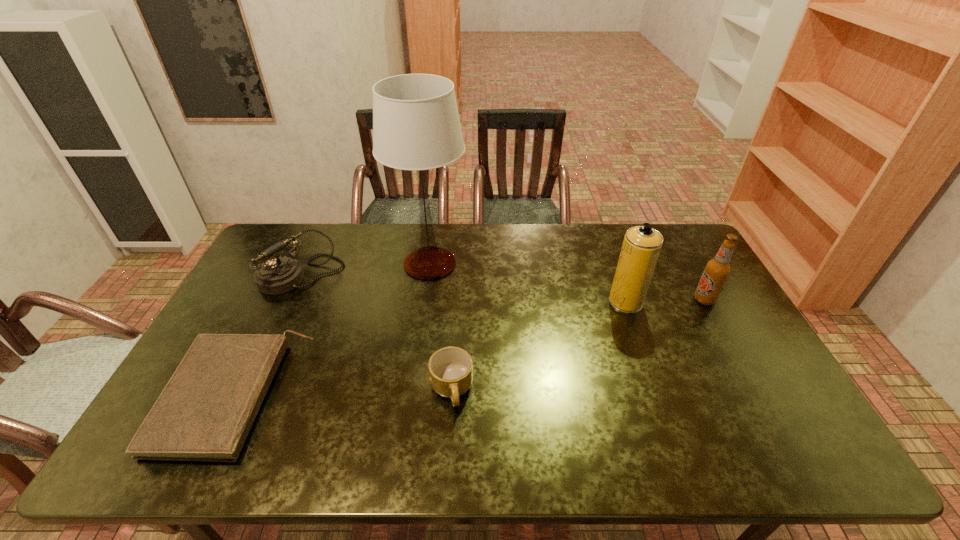
Find the location of `paperback book present at the left edge`. paperback book present at the left edge is located at coordinates (205, 412).

Identify the location of object present at the right edge. Image resolution: width=960 pixels, height=540 pixels. (717, 270).

Where is `object that is at the far left corner`? This screenshot has height=540, width=960. object that is at the far left corner is located at coordinates (278, 275).

You are a GUI agent. You are given a task and a screenshot of the screen. Output one action in this format:
    pyautogui.click(x=<x>, y=<y>)
    Task: Click on the object situated at the near left corner
    Image resolution: width=960 pixels, height=540 pixels.
    Given the screenshot: What is the action you would take?
    pyautogui.click(x=205, y=412)

In the image, there is a desktop. Identify the location of vacant space at the far edge. (537, 240).

The image size is (960, 540). Identify the location of vacant region at the near edge of the desktop. (667, 455).

In the image, there is a desktop. Where is `free space at the right edge`? free space at the right edge is located at coordinates (744, 392).

This screenshot has height=540, width=960. In the image, there is a desktop. In order to click on vacant space at the far left corner in this screenshot , I will do `click(261, 260)`.

Locate an element on the screen. The width and height of the screenshot is (960, 540). free space between the telephone and the rightmost object is located at coordinates (503, 288).

This screenshot has height=540, width=960. I want to click on vacant region between the mug and the telephone, so click(x=376, y=333).